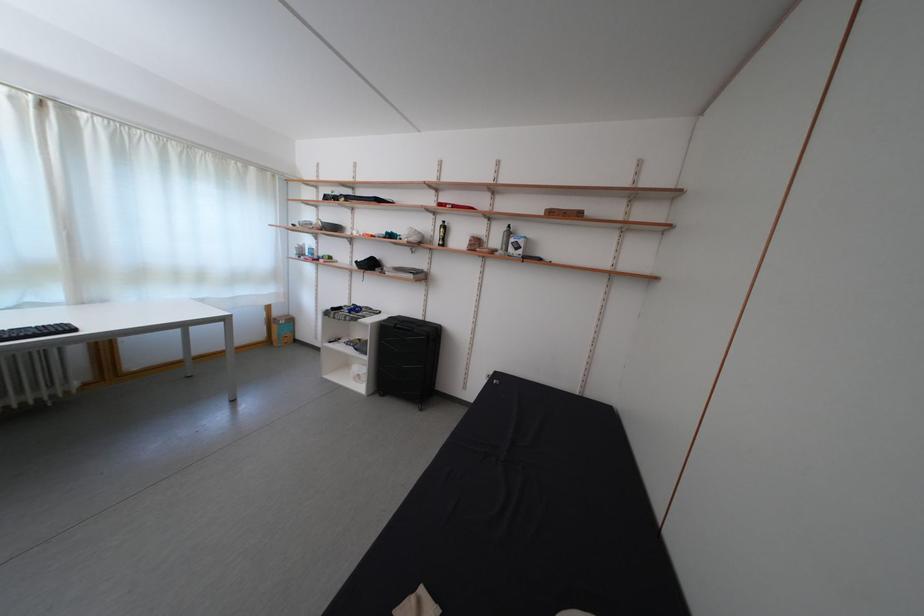
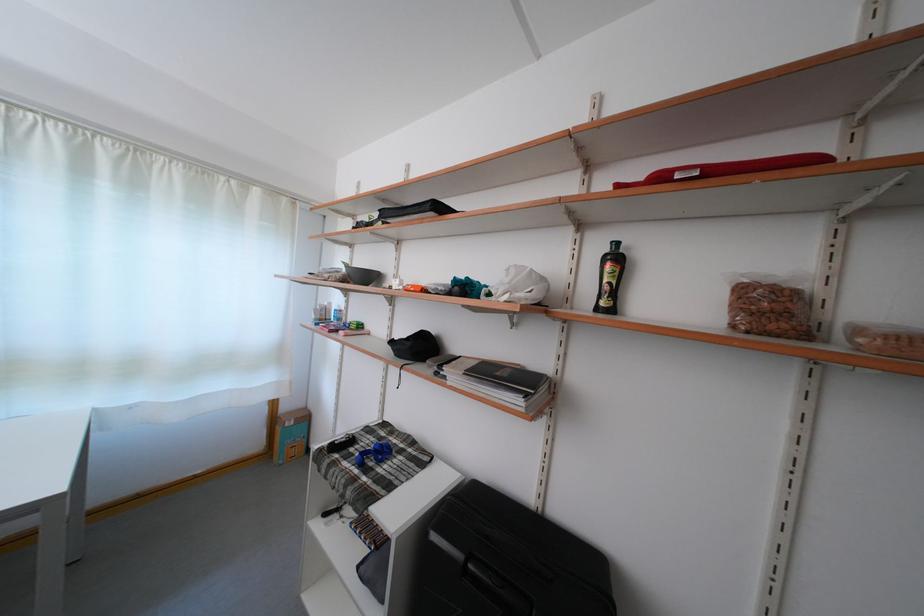
Question: What movement of the cameraman would produce the second image?

Choices:
 (A) Left
 (B) Right
 (C) Forward
 (D) Backward

Answer: (C)